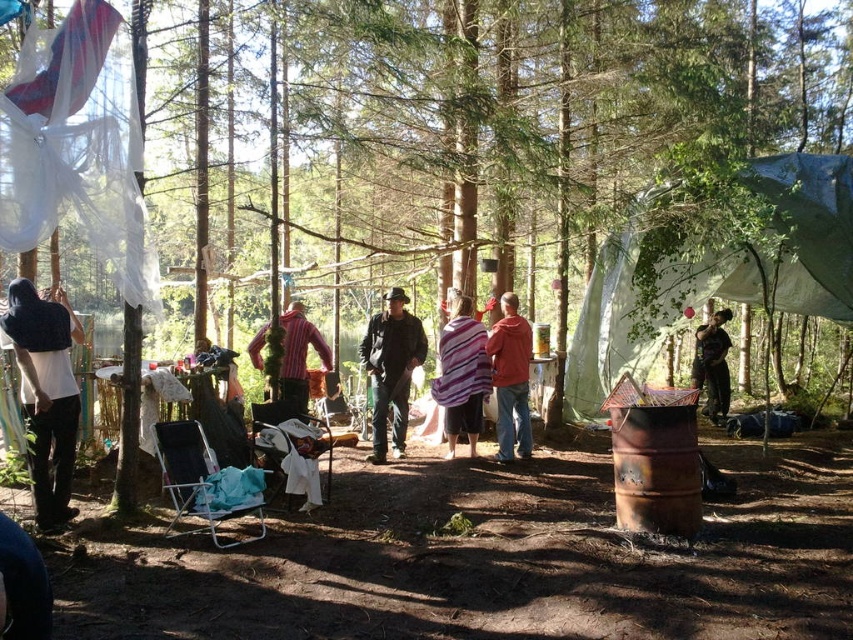
You are organizing a clothing display at the campsite. You have two items to hang on a clothesline that can only hold items up to 3 feet in length. The striped fabric shirt at center and the dark brown leather jacket at lower right are available. Which item can be safely hung without exceeding the clothesline length limit?

The striped fabric shirt at center is shorter than the dark brown leather jacket at lower right, so the striped fabric shirt at center can be safely hung on the clothesline without exceeding the 3 feet length limit.